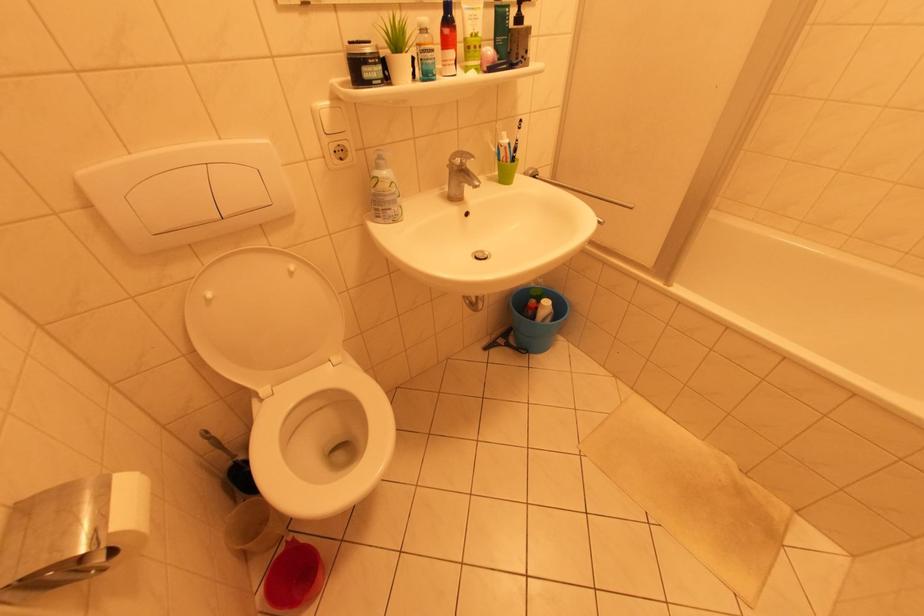
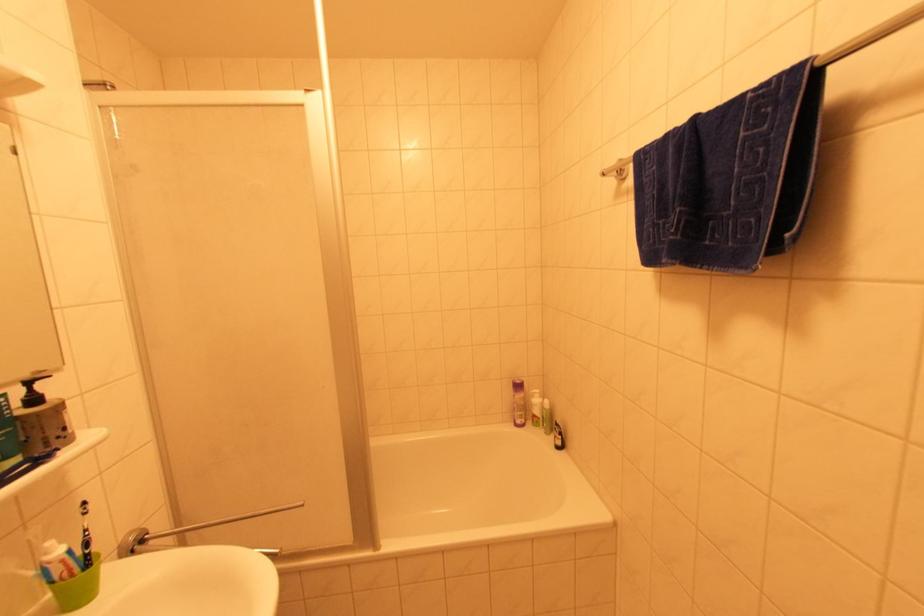
Question: Based on the continuous images, in which direction is the camera rotating? Reply with the corresponding letter.

Choices:
 (A) Left
 (B) Right
 (C) Up
 (D) Down

Answer: (B)